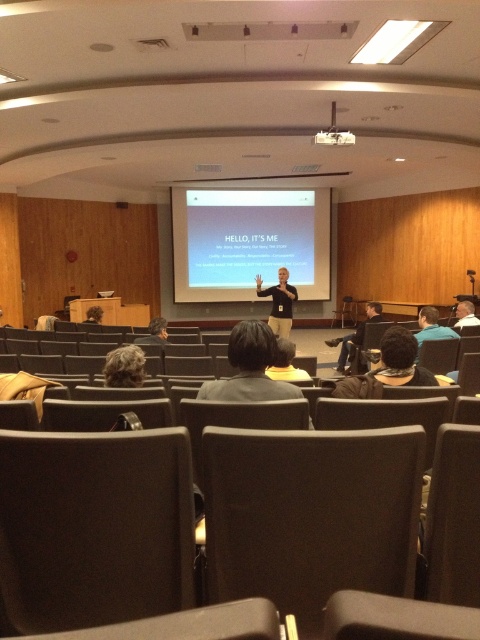
You are organizing a small meeting in the lecture hall and need to place a round table with a diameter of 1.2 meters. The table must be positioned exactly where the dark brown fabric chair at center is currently located. Is there enough space for the table at that location without overlapping any existing furniture or structures?

The dark brown fabric chair at center is located at point (311, 515). Since the table requires 1.2 meters in diameter, and the chair is at a specific coordinate, there is no mention of any nearby obstacles in the scene description. However, the scene mentions rows of chairs in the foreground facing the front. It is possible that placing a 1.2m diameter table at that location might interfere with the existing rows of chairs or other structures. Without exact spatial dimensions, it is uncertain if there is

You are attending a presentation in the lecture hall and notice two items in the front row. The dark brown leather chair at lower left and the dark blue jeans at center. From your perspective sitting in the audience, which item is positioned to the right?

The dark blue jeans at center is positioned to the right of the dark brown leather chair at lower left.